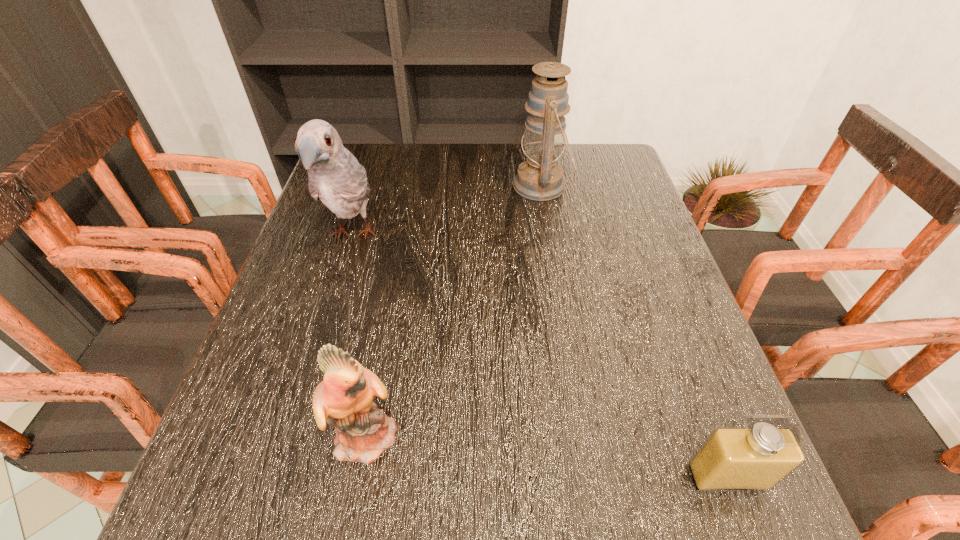
Identify the location of oil lamp. (540, 178).

Image resolution: width=960 pixels, height=540 pixels. I want to click on the leftmost object, so click(x=335, y=177).

Where is `the left parrot`? the left parrot is located at coordinates (335, 177).

This screenshot has height=540, width=960. Find the location of `the third object from right to left`. the third object from right to left is located at coordinates (344, 399).

This screenshot has width=960, height=540. Identify the location of the second shortest object. (344, 399).

At what (x,y) coordinates should I click in order to perform the action: click on the rightmost object. Please return your answer as a coordinate pair (x, y). This screenshot has width=960, height=540. Looking at the image, I should click on (755, 458).

At what (x,y) coordinates should I click in order to perform the action: click on the shortest object. Please return your answer as a coordinate pair (x, y). Looking at the image, I should click on (755, 458).

Where is `blank space located on the back of the oil lamp`? The width and height of the screenshot is (960, 540). blank space located on the back of the oil lamp is located at coordinates (535, 144).

Where is `vacant region located 0.220m on the front-facing side of the farther parrot`? vacant region located 0.220m on the front-facing side of the farther parrot is located at coordinates (315, 362).

You are a GUI agent. You are given a task and a screenshot of the screen. Output one action in this format:
    pyautogui.click(x=<x>, y=<y>)
    Task: Click on the free space located 0.250m on the front-facing side of the right parrot
    
    Given the screenshot: What is the action you would take?
    pyautogui.click(x=554, y=434)